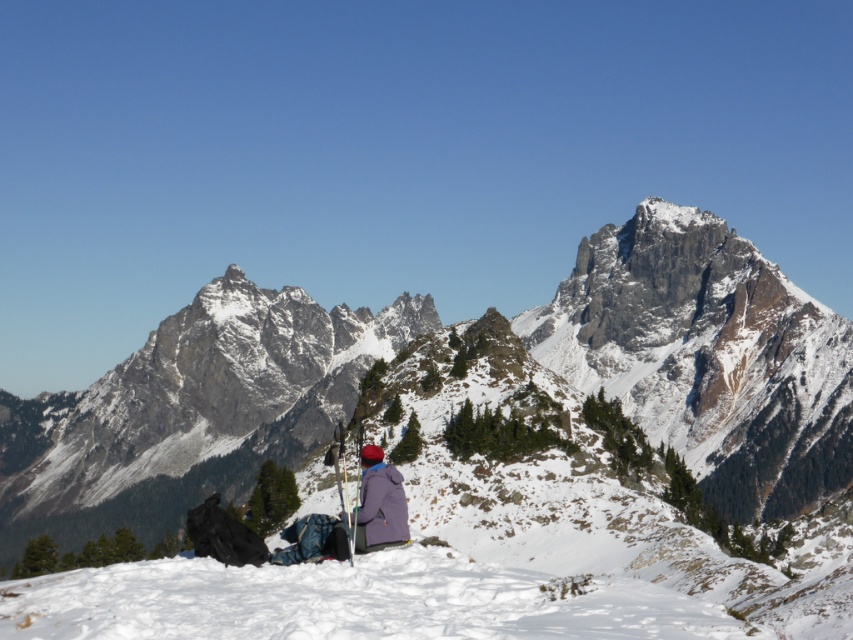
Question: Considering the relative positions of snowy rocky mountain at center and purple fleece jacket at center in the image provided, where is snowy rocky mountain at center located with respect to purple fleece jacket at center?

Choices:
 (A) left
 (B) right

Answer: (A)

Question: In this image, where is snowy rocky mountain at center located relative to purple fleece jacket at center?

Choices:
 (A) right
 (B) left

Answer: (B)

Question: Can you confirm if snowy rocky mountain at center is positioned above purple fleece jacket at center?

Choices:
 (A) no
 (B) yes

Answer: (B)